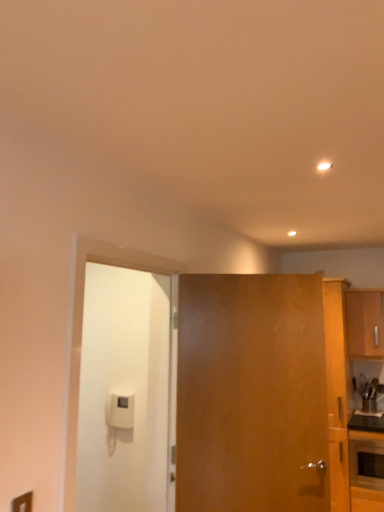
What do you see at coordinates (365, 323) in the screenshot? I see `wooden cabinet at right` at bounding box center [365, 323].

You are a GUI agent. You are given a task and a screenshot of the screen. Output one action in this format:
    pyautogui.click(x=<x>, y=<y>)
    Task: Click on the matte black oven at lower right
    
    Given the screenshot: What is the action you would take?
    pyautogui.click(x=366, y=463)

Locate an element on the screen. white matte door at left, the 1th door in the left-to-right sequence is located at coordinates (124, 391).

Would you say wooden door at center, the 2th door from the left, is to the left or to the right of white matte door at left, the 2th door when ordered from right to left, in the picture?

In the image, wooden door at center, the 2th door from the left, appears on the right side of white matte door at left, the 2th door when ordered from right to left.

From the image's perspective, between wooden door at center, which is the first door in right-to-left order, and white matte door at left, the 2th door when ordered from right to left, who is located below?

From the image's view, wooden door at center, which is the first door in right-to-left order, is below.

Is wooden door at center, which is the first door in right-to-left order, positioned in front of white matte door at left, the 2th door when ordered from right to left?

No, it is behind white matte door at left, the 2th door when ordered from right to left.

Does wooden door at center, the 2th door from the left, turn towards white matte door at left, the 1th door in the left-to-right sequence?

No, wooden door at center, the 2th door from the left, is not turned towards white matte door at left, the 1th door in the left-to-right sequence.

Is white matte door at left, the 1th door in the left-to-right sequence, shorter than wooden door at center, the 2th door from the left?

Incorrect, the height of white matte door at left, the 1th door in the left-to-right sequence, does not fall short of that of wooden door at center, the 2th door from the left.

Relative to wooden door at center, which is the first door in right-to-left order, is white matte door at left, the 1th door in the left-to-right sequence, in front or behind?

white matte door at left, the 1th door in the left-to-right sequence, is positioned closer to the viewer than wooden door at center, which is the first door in right-to-left order.

Between point (114, 492) and point (216, 424), which one is positioned in front?

The point (216, 424) is closer.

Which is in front, point (370, 484) or point (250, 390)?

The point (250, 390) is closer to the camera.

Is matte black oven at lower right facing away from wooden door at center, the 2th door from the left?

No, wooden door at center, the 2th door from the left, is not at the back of matte black oven at lower right.

Where is `appliance that appears on the right of wooden door at center, the 2th door from the left`? This screenshot has height=512, width=384. appliance that appears on the right of wooden door at center, the 2th door from the left is located at coordinates (366, 463).

Can we say wooden door at center, the 2th door from the left, lies outside matte black oven at lower right?

Yes.

Does wooden door at center, which is the first door in right-to-left order, lie behind matte black oven at lower right?

No, the depth of wooden door at center, which is the first door in right-to-left order, is less than that of matte black oven at lower right.

From a real-world perspective, who is located higher, wooden door at center, the 2th door from the left, or matte black oven at lower right?

In real-world perspective, wooden door at center, the 2th door from the left, is above.

Which of these two, wooden door at center, the 2th door from the left, or matte black oven at lower right, is bigger?

With larger size is wooden door at center, the 2th door from the left.

Which is behind, wooden cabinet at right or wooden door at center, which is the first door in right-to-left order?

wooden cabinet at right is further away from the camera.

From the picture: Is wooden cabinet at right smaller than wooden door at center, the 2th door from the left?

Indeed, wooden cabinet at right has a smaller size compared to wooden door at center, the 2th door from the left.

Is point (347, 321) positioned in front of point (200, 349)?

That is False.

From a real-world perspective, is white matte door at left, the 1th door in the left-to-right sequence, physically located above or below matte black oven at lower right?

white matte door at left, the 1th door in the left-to-right sequence, is situated higher than matte black oven at lower right in the real world.

Considering the positions of points (132, 451) and (353, 469), is point (132, 451) closer to camera compared to point (353, 469)?

Yes, point (132, 451) is in front of point (353, 469).

Is matte black oven at lower right located within white matte door at left, the 2th door when ordered from right to left?

No, matte black oven at lower right is not surrounded by white matte door at left, the 2th door when ordered from right to left.

Between white matte door at left, the 2th door when ordered from right to left, and matte black oven at lower right, which one has larger size?

With larger size is white matte door at left, the 2th door when ordered from right to left.

Is wooden door at center, which is the first door in right-to-left order, oriented towards wooden cabinet at right?

No, wooden door at center, which is the first door in right-to-left order, is not facing towards wooden cabinet at right.

Are wooden door at center, the 2th door from the left, and wooden cabinet at right beside each other?

No, wooden door at center, the 2th door from the left, is not with wooden cabinet at right.

Considering the relative sizes of wooden door at center, the 2th door from the left, and wooden cabinet at right in the image provided, is wooden door at center, the 2th door from the left, bigger than wooden cabinet at right?

Correct, wooden door at center, the 2th door from the left, is larger in size than wooden cabinet at right.

In the scene shown: From a real-world perspective, is wooden door at center, the 2th door from the left, under wooden cabinet at right?

Yes, from a real-world perspective, wooden door at center, the 2th door from the left, is below wooden cabinet at right.

You are a GUI agent. You are given a task and a screenshot of the screen. Output one action in this format:
    pyautogui.click(x=<x>, y=<y>)
    Task: Click on the door in front of the wooden door at center, which is the first door in right-to-left order
    
    Given the screenshot: What is the action you would take?
    pyautogui.click(x=124, y=391)

Find the location of `door behind the white matte door at left, the 2th door when ordered from right to left`. door behind the white matte door at left, the 2th door when ordered from right to left is located at coordinates (251, 394).

From the image, which object appears to be nearer to wooden cabinet at right, white matte door at left, the 1th door in the left-to-right sequence, or matte black oven at lower right?

The object closer to wooden cabinet at right is matte black oven at lower right.

Looking at the image, which one is located closer to matte black oven at lower right, white matte door at left, the 1th door in the left-to-right sequence, or wooden door at center, the 2th door from the left?

wooden door at center, the 2th door from the left, is positioned closer to the anchor matte black oven at lower right.

Looking at this image, which object lies further to the anchor point white matte door at left, the 2th door when ordered from right to left, matte black oven at lower right or wooden door at center, the 2th door from the left?

Based on the image, matte black oven at lower right appears to be further to white matte door at left, the 2th door when ordered from right to left.

Looking at the image, which one is located further to wooden door at center, the 2th door from the left, white matte door at left, the 1th door in the left-to-right sequence, or matte black oven at lower right?

matte black oven at lower right.

Consider the image. Looking at the image, which one is located closer to wooden door at center, the 2th door from the left, matte black oven at lower right or wooden cabinet at right?

Based on the image, matte black oven at lower right appears to be nearer to wooden door at center, the 2th door from the left.

Estimate the real-world distances between objects in this image. Which object is closer to matte black oven at lower right, white matte door at left, the 1th door in the left-to-right sequence, or wooden cabinet at right?

Among the two, wooden cabinet at right is located nearer to matte black oven at lower right.

Which object lies nearer to the anchor point matte black oven at lower right, wooden cabinet at right or wooden door at center, the 2th door from the left?

wooden cabinet at right lies closer to matte black oven at lower right than the other object.

Based on their spatial positions, is matte black oven at lower right or wooden cabinet at right further from white matte door at left, the 1th door in the left-to-right sequence?

The object further to white matte door at left, the 1th door in the left-to-right sequence, is wooden cabinet at right.

Locate an element on the screen. appliance between wooden door at center, which is the first door in right-to-left order, and wooden cabinet at right from front to back is located at coordinates (366, 463).

In order to click on door located between white matte door at left, the 2th door when ordered from right to left, and matte black oven at lower right in the left-right direction in this screenshot , I will do `click(251, 394)`.

Find the location of a particular element. appliance between white matte door at left, the 2th door when ordered from right to left, and wooden cabinet at right from front to back is located at coordinates (366, 463).

Locate an element on the screen. This screenshot has height=512, width=384. door located between white matte door at left, the 1th door in the left-to-right sequence, and wooden cabinet at right in the depth direction is located at coordinates (251, 394).